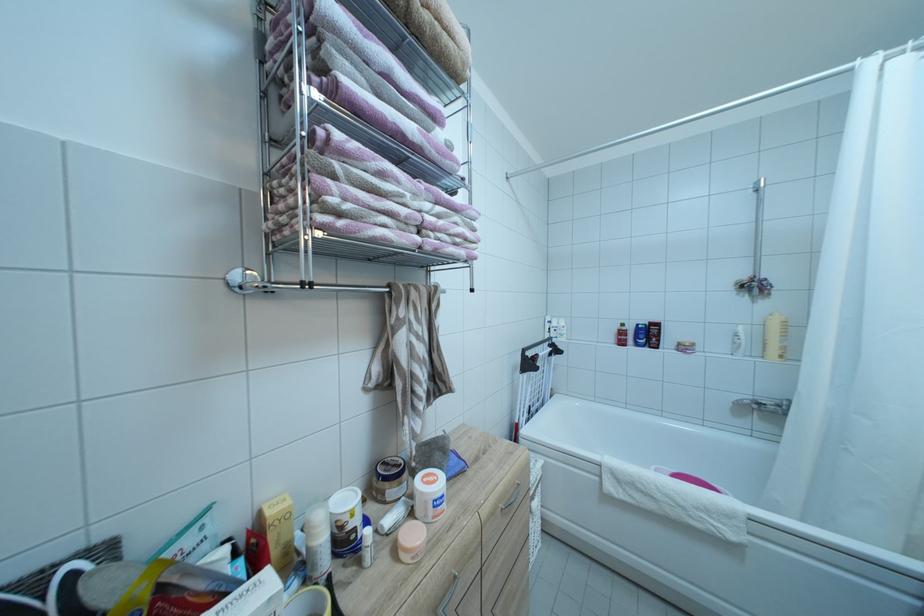
The width and height of the screenshot is (924, 616). What are the coordinates of `metal shower head` in the screenshot? It's located at (758, 188).